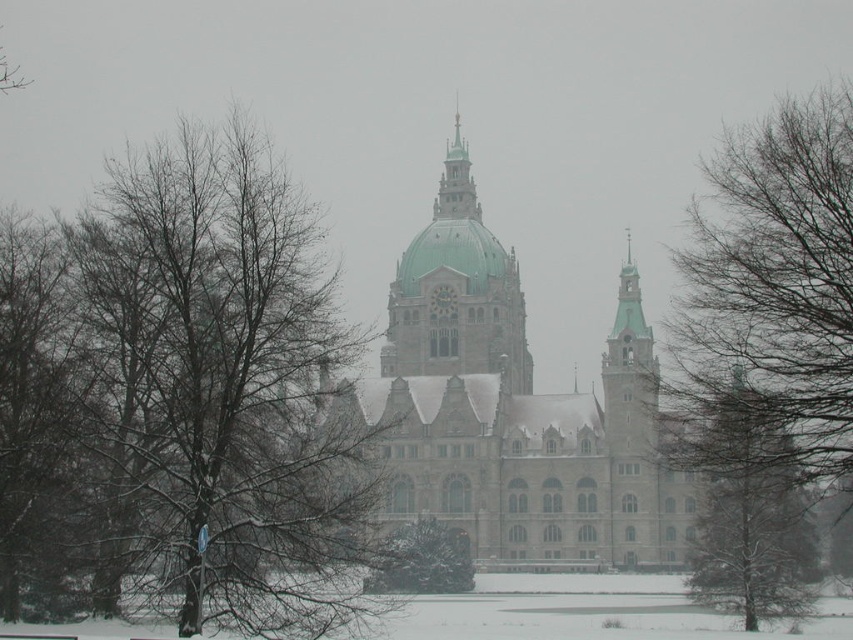
Question: Is green textured pine tree at center further to camera compared to green textured tree at center?

Choices:
 (A) yes
 (B) no

Answer: (B)

Question: Among these points, which one is farthest from the camera?

Choices:
 (A) (769, 554)
 (B) (465, 145)

Answer: (B)

Question: Does green stone church at center appear under green glazed dome at center?

Choices:
 (A) no
 (B) yes

Answer: (B)

Question: Based on their relative distances, which object is nearer to the polished copper spire at center?

Choices:
 (A) green glazed dome at center
 (B) bare branches at left
 (C) green textured tree at center

Answer: (A)

Question: Is green textured tree at center bigger than polished copper spire at center?

Choices:
 (A) no
 (B) yes

Answer: (A)

Question: Among these points, which one is nearest to the camera?

Choices:
 (A) (495, 289)
 (B) (380, 582)

Answer: (B)